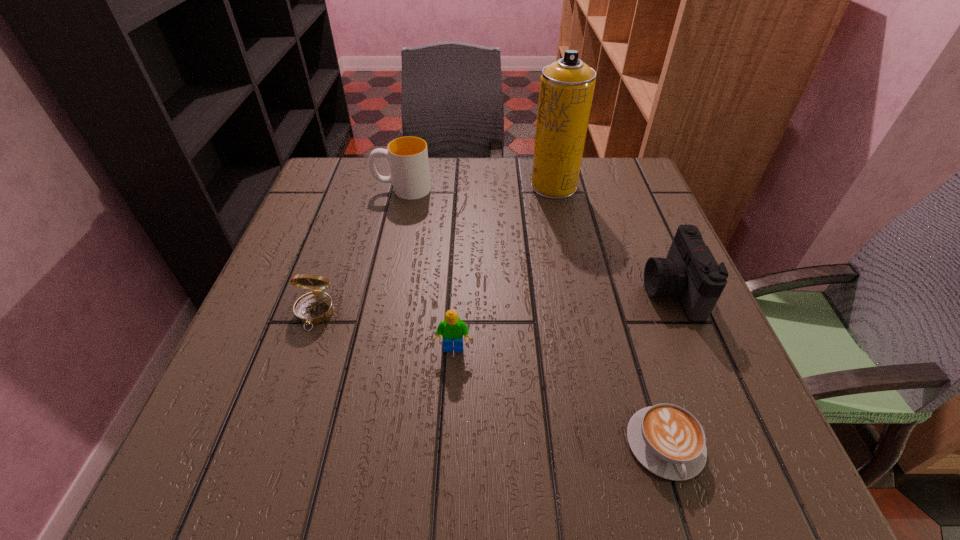
This screenshot has height=540, width=960. I want to click on free space located 0.130m with the handle on the side of the second object from left to right, so click(x=323, y=189).

The width and height of the screenshot is (960, 540). I want to click on vacant area located with the handle on the side of the second object from left to right, so click(x=342, y=189).

Identify the location of free space located 0.250m at the lens of the camera. (517, 291).

Identify the location of vacant region located at the lens of the camera. The width and height of the screenshot is (960, 540). (605, 291).

You are a GUI agent. You are given a task and a screenshot of the screen. Output one action in this format:
    pyautogui.click(x=<x>, y=<y>)
    Task: Click on the vacant space situated 0.050m at the lens of the camera
    
    Given the screenshot: What is the action you would take?
    (x=620, y=291)

This screenshot has height=540, width=960. What are the coordinates of `blank space located on the face of the fifth farthest object` in the screenshot? It's located at (448, 455).

You are a GUI agent. You are given a task and a screenshot of the screen. Output one action in this format:
    pyautogui.click(x=<x>, y=<y>)
    Task: Click on the vacant space located 0.150m with the dial facing the compass
    The height and width of the screenshot is (540, 960).
    Given the screenshot: What is the action you would take?
    pyautogui.click(x=281, y=408)

The height and width of the screenshot is (540, 960). Identify the location of aerosol can that is positioned at the far edge. (567, 86).

This screenshot has height=540, width=960. I want to click on cup situated at the far edge, so click(x=408, y=156).

Locate an element on the screen. The width and height of the screenshot is (960, 540). object that is at the near edge is located at coordinates (666, 439).